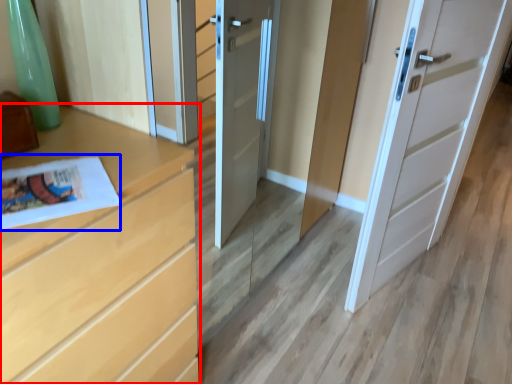
Question: Among these objects, which one is nearest to the camera, chest of drawers (highlighted by a red box) or magazine (highlighted by a blue box)?

Choices:
 (A) chest of drawers
 (B) magazine

Answer: (A)